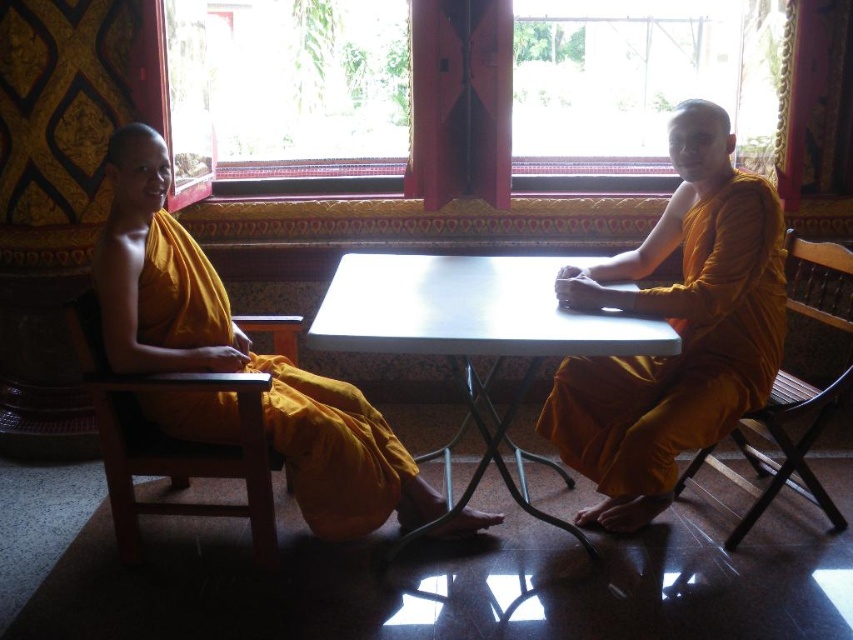
You are a visitor in the temple and want to sit down at the white plastic table at center. Which side of the table should you choose to sit on if you want to be on the same side as the matte yellow robe at center?

The matte yellow robe at center is positioned on the right side of white plastic table at center, so you should choose the right side of the table to sit on to be on the same side as the matte yellow robe at center.

You are an interior designer planning to place a large sculpture in this temple scene. The sculpture must fit between the matte yellow robe at center and the white plastic table at center. Given their sizes, will the sculpture fit comfortably without overcrowding the space?

The matte yellow robe at center is smaller than the white plastic table at center, so there should be sufficient space between them to place the sculpture comfortably without overcrowding.

You are standing in the temple and want to walk towards the wooden frame window at center and the matte yellow robe at center. Which object will you reach first?

You will reach the wooden frame window at center first because it is closer to you than the matte yellow robe at center.